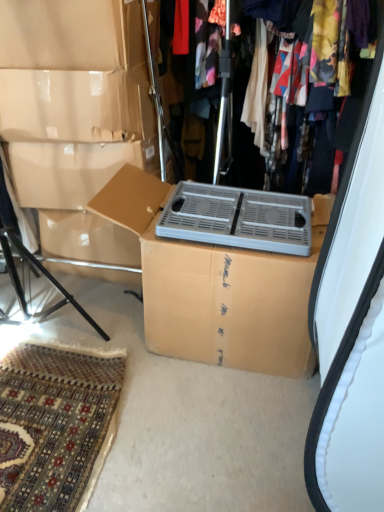
Question: Considering their positions, is cardboard box at center located in front of or behind gray plastic crate at center?

Choices:
 (A) behind
 (B) front

Answer: (B)

Question: Looking at their shapes, would you say cardboard box at center is wider or thinner than gray plastic crate at center?

Choices:
 (A) thin
 (B) wide

Answer: (B)

Question: Considering the real-world distances, which object is closest to the gray plastic crate at center?

Choices:
 (A) cardboard box at center
 (B) beige cardboard box at center
 (C) metallic silver heater at upper center

Answer: (A)

Question: Estimate the real-world distances between objects in this image. Which object is farther from the metallic silver heater at upper center?

Choices:
 (A) gray plastic crate at center
 (B) cardboard box at center
 (C) beige cardboard box at center

Answer: (B)